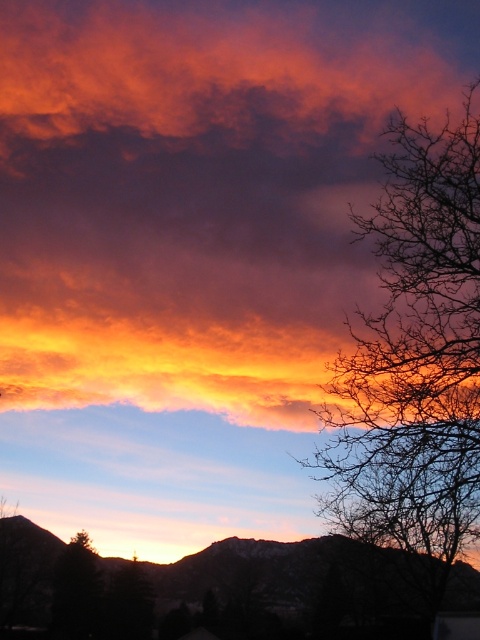
Question: Does vivid orange cloud at upper center appear on the left side of bare branches at right?

Choices:
 (A) yes
 (B) no

Answer: (A)

Question: Is vivid orange cloud at upper center above bare branches at right?

Choices:
 (A) no
 (B) yes

Answer: (B)

Question: Which object appears closest to the camera in this image?

Choices:
 (A) vivid orange cloud at upper center
 (B) bare branches at right

Answer: (B)

Question: Is vivid orange cloud at upper center positioned at the back of bare branches at right?

Choices:
 (A) yes
 (B) no

Answer: (A)